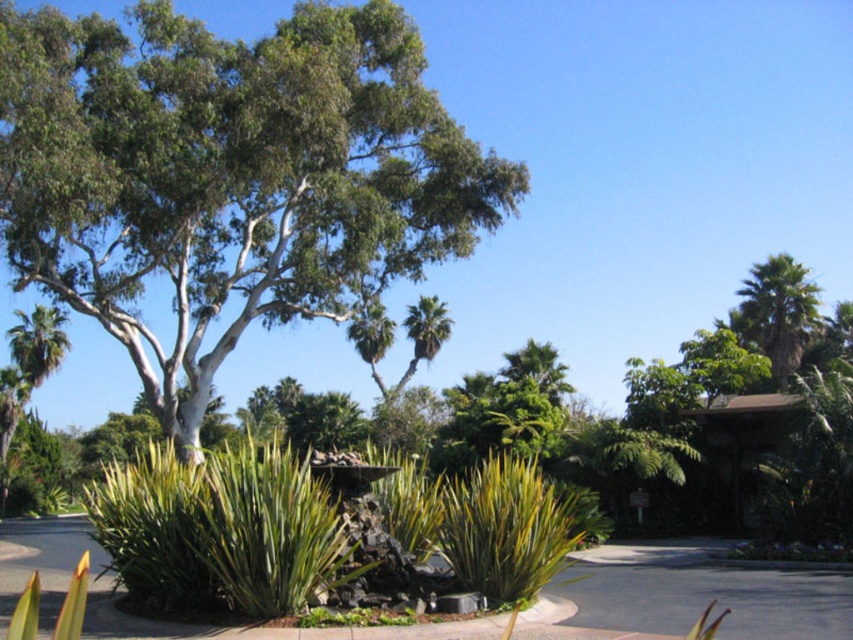
Question: Based on their relative distances, which object is farther from the smooth concrete pavement at center?

Choices:
 (A) green leafy tree at center
 (B) green leafy palm at upper right

Answer: (B)

Question: Is green leafy tree at center wider than smooth concrete pavement at center?

Choices:
 (A) yes
 (B) no

Answer: (A)

Question: Which point is farther to the camera?

Choices:
 (A) (20, 250)
 (B) (724, 589)

Answer: (A)

Question: Based on their relative distances, which object is nearer to the green leafy palm at upper right?

Choices:
 (A) smooth concrete pavement at center
 (B) green leafy tree at center

Answer: (B)

Question: Is green leafy tree at center above green leafy palm at upper right?

Choices:
 (A) no
 (B) yes

Answer: (A)

Question: Can you confirm if green leafy tree at center is wider than green leafy palm at upper right?

Choices:
 (A) no
 (B) yes

Answer: (A)